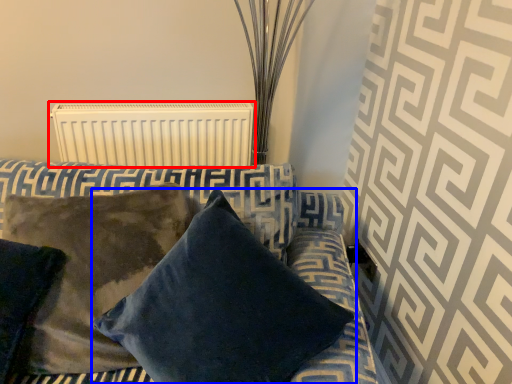
Question: Among these objects, which one is farthest to the camera, radiator (highlighted by a red box) or pillow (highlighted by a blue box)?

Choices:
 (A) radiator
 (B) pillow

Answer: (A)